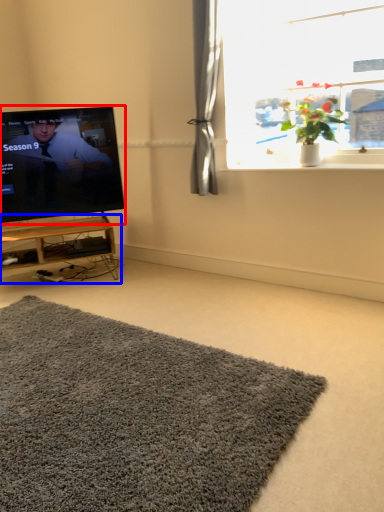
Question: Which object appears farthest to the camera in this image, television (highlighted by a red box) or table (highlighted by a blue box)?

Choices:
 (A) television
 (B) table

Answer: (B)